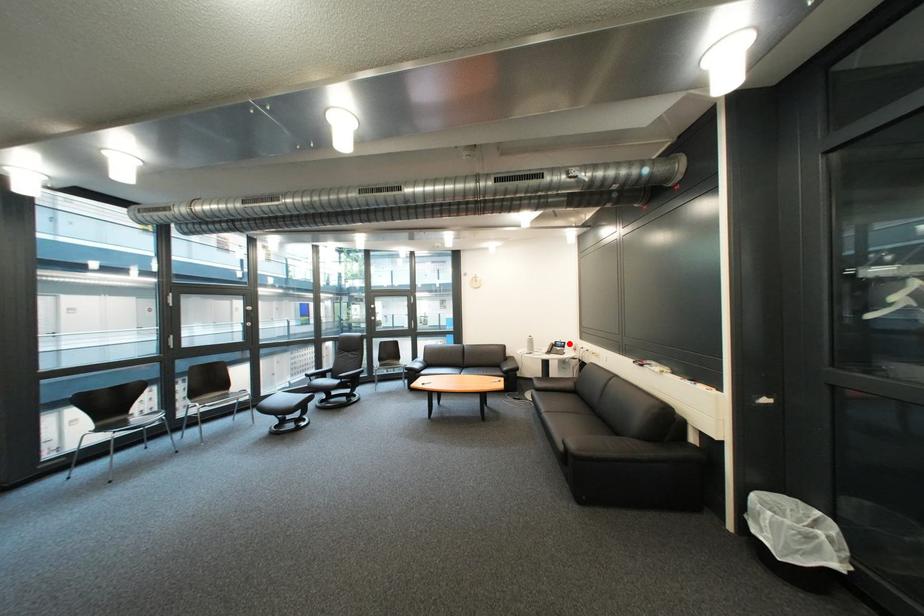
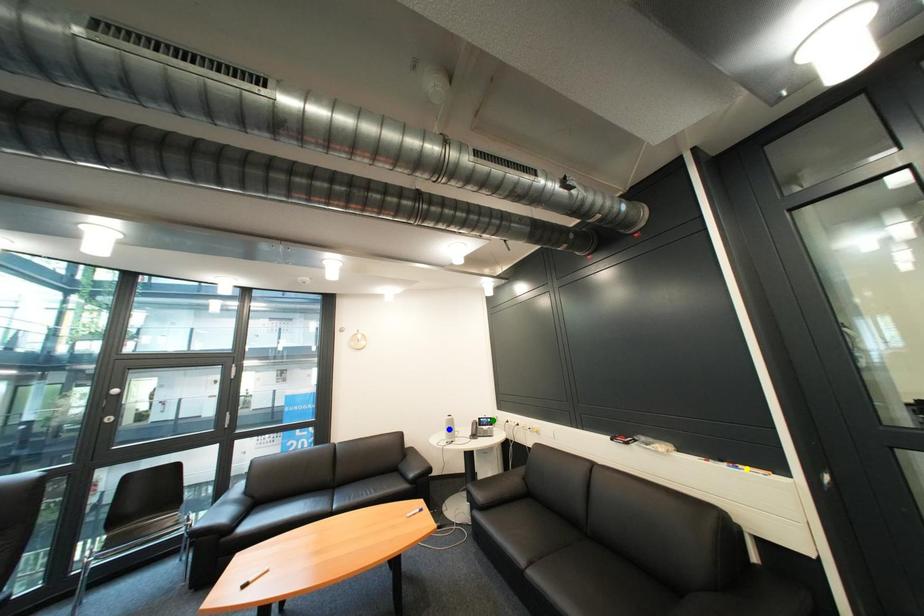
Question: I am providing you with two images of the same scene from different viewpoints. A red point is marked on the first image. You are given multiple points on the second image. Which point in image 2 represents the same 3d spot as the red point in image 1?

Choices:
 (A) yellow point
 (B) blue point
 (C) green point

Answer: (C)